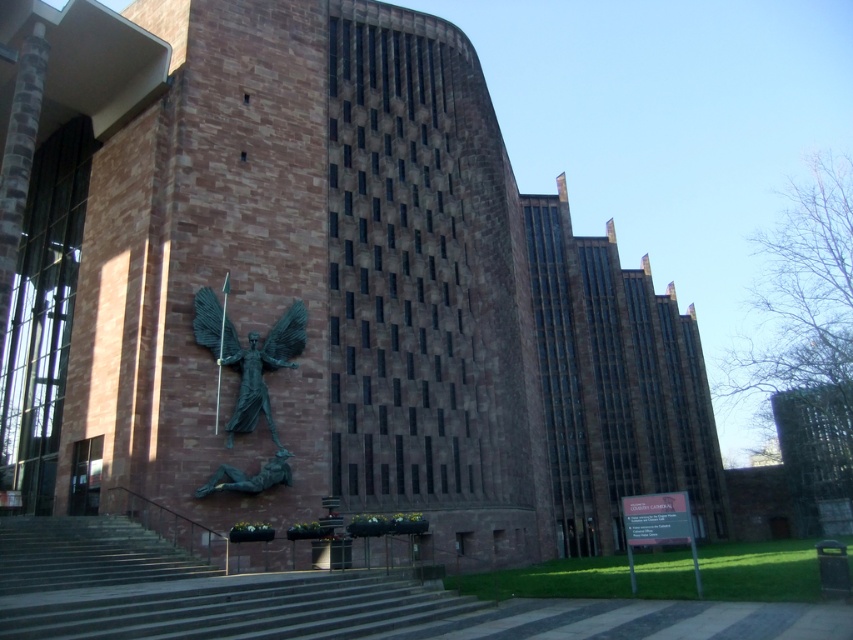
You are standing at the base of the building and want to take a photo of the bronze statue at center with your camera. The camera has a maximum zoom range of 100 meters. Will you be able to capture the entire statue in the photo without moving closer?

The bronze statue at center and camera are 35.36 meters apart from each other. Since the camera can zoom up to 100 meters, which is greater than the distance between them, you can capture the entire statue without moving closer.